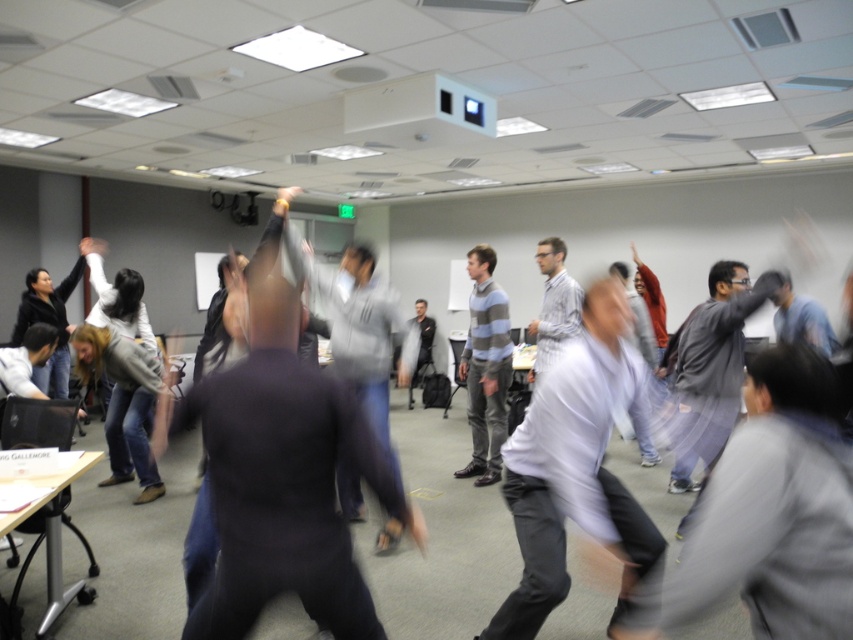
Can you confirm if gray fabric shirt at center is wider than white shirt at center?

Incorrect, gray fabric shirt at center's width does not surpass white shirt at center's.

Can you confirm if gray fabric shirt at center is positioned to the right of white shirt at center?

Yes, gray fabric shirt at center is to the right of white shirt at center.

Between point (843, 541) and point (584, 396), which one is positioned in front?

Positioned in front is point (843, 541).

You are a GUI agent. You are given a task and a screenshot of the screen. Output one action in this format:
    pyautogui.click(x=<x>, y=<y>)
    Task: Click on the gray fabric shirt at center
    
    Given the screenshot: What is the action you would take?
    pyautogui.click(x=772, y=513)

Is point (828, 515) positioned behind point (469, 353)?

That is False.

Is gray fabric shirt at center positioned before striped sweater at center?

Yes, gray fabric shirt at center is closer to the viewer.

Which is behind, point (798, 528) or point (491, 317)?

The point (491, 317) is more distant.

Identify the location of gray fabric shirt at center. (772, 513).

Based on the photo, between gray fabric shirt at center and matte black hand at upper center, which one appears on the left side from the viewer's perspective?

Positioned to the left is gray fabric shirt at center.

How distant is gray fabric shirt at center from matte black hand at upper center?

gray fabric shirt at center and matte black hand at upper center are 19.55 feet apart.

Between point (816, 518) and point (636, 259), which one is positioned in front?

Point (816, 518)

Identify the location of gray fabric shirt at center. (772, 513).